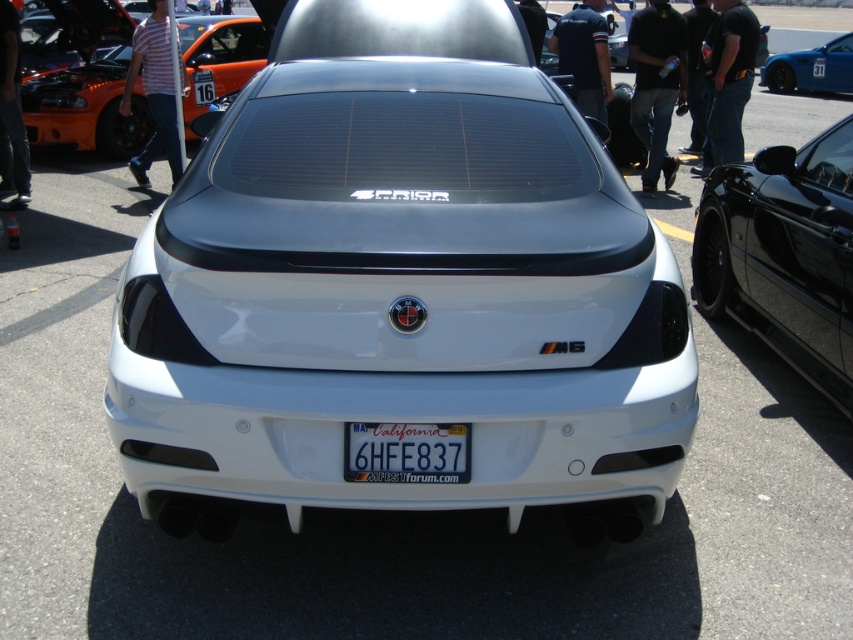
Is point (350, 467) positioned before point (788, 88)?

Yes, point (350, 467) is in front of point (788, 88).

Which is in front, point (376, 476) or point (825, 84)?

Positioned in front is point (376, 476).

Who is more distant from viewer, (349, 451) or (804, 58)?

Positioned behind is point (804, 58).

The image size is (853, 640). In order to click on california blue metal license plate at center in this screenshot , I will do `click(405, 452)`.

In the scene shown: Can you confirm if white glossy car at center is bigger than orange matte sports car at upper left?

Yes.

Who is higher up, white glossy car at center or orange matte sports car at upper left?

orange matte sports car at upper left

Does point (485, 403) come behind point (183, 28)?

No, (485, 403) is in front of (183, 28).

Image resolution: width=853 pixels, height=640 pixels. Find the location of `white glossy car at center`. white glossy car at center is located at coordinates (399, 285).

Who is more distant from viewer, (788, 352) or (759, 76)?

The point (759, 76) is behind.

Does black glossy car at right appear on the left side of blue glossy car at upper right?

Correct, you'll find black glossy car at right to the left of blue glossy car at upper right.

Is point (726, 227) closer to viewer compared to point (843, 90)?

Yes.

Where is `black glossy car at right`? black glossy car at right is located at coordinates (784, 253).